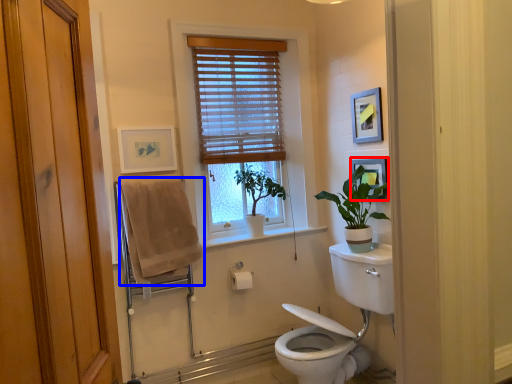
Question: Which point is further to the camera, picture frame (highlighted by a red box) or bath towel (highlighted by a blue box)?

Choices:
 (A) picture frame
 (B) bath towel

Answer: (A)